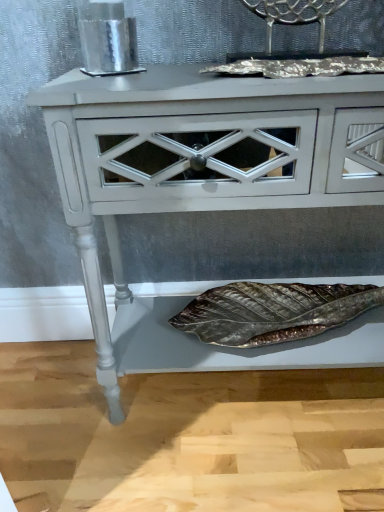
At what (x,y) coordinates should I click in order to perform the action: click on free space in front of matte white wooden nightstand at center. Please return your answer as a coordinate pair (x, y). The height and width of the screenshot is (512, 384). Looking at the image, I should click on (265, 466).